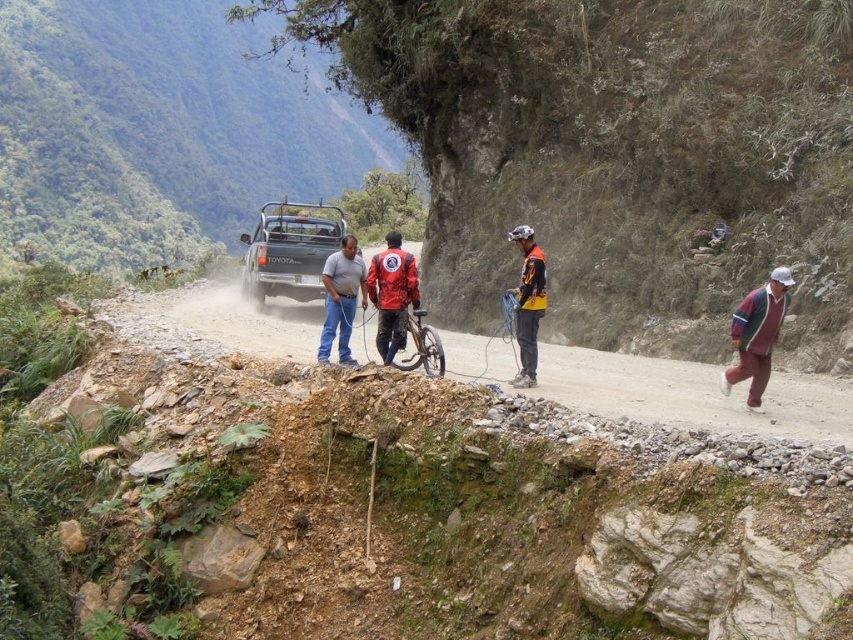
From the picture: You are a delivery driver who needs to pass through the mountainous area shown. You see a green matte truck at center and a red matte jacket at center. Which object is higher up the mountain?

The green matte truck at center is located above the red matte jacket at center, so the green matte truck at center is higher up the mountain.